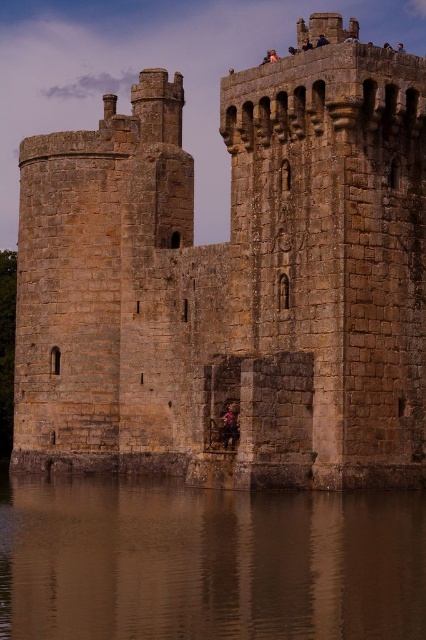
Question: Which object is positioned closest to the brown matte water at lower center?

Choices:
 (A) brown stone castle at center
 (B) dark brown leather jacket at center

Answer: (B)

Question: Can you confirm if brown stone castle at center is bigger than brown matte water at lower center?

Choices:
 (A) no
 (B) yes

Answer: (B)

Question: Does brown stone castle at center have a lesser width compared to dark brown leather jacket at center?

Choices:
 (A) yes
 (B) no

Answer: (B)

Question: Which of the following is the farthest from the observer?

Choices:
 (A) (155, 332)
 (B) (235, 432)
 (C) (370, 522)

Answer: (A)

Question: Which of the following is the closest to the observer?

Choices:
 (A) (157, 163)
 (B) (150, 486)
 (C) (238, 433)

Answer: (C)

Question: Does brown matte water at lower center have a smaller size compared to dark brown leather jacket at center?

Choices:
 (A) no
 (B) yes

Answer: (A)